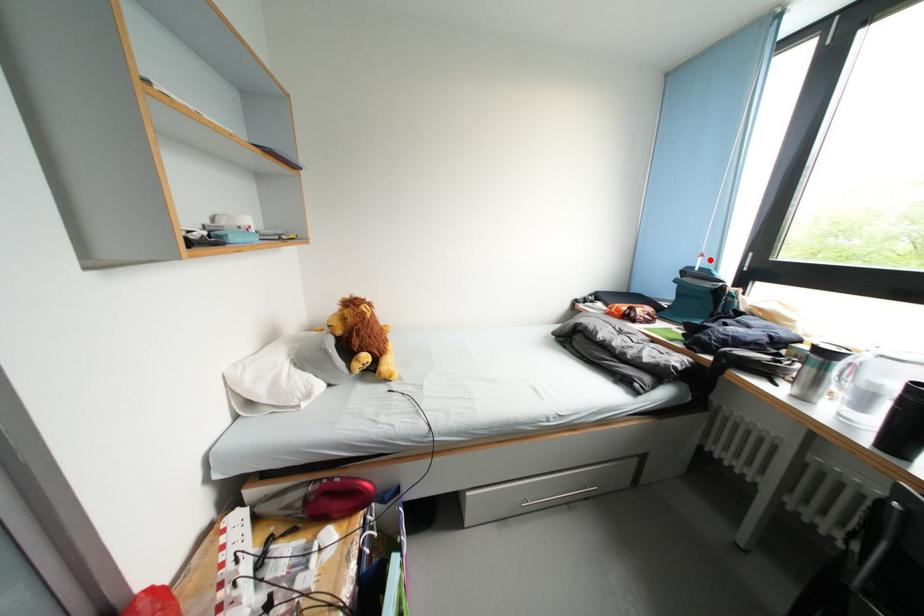
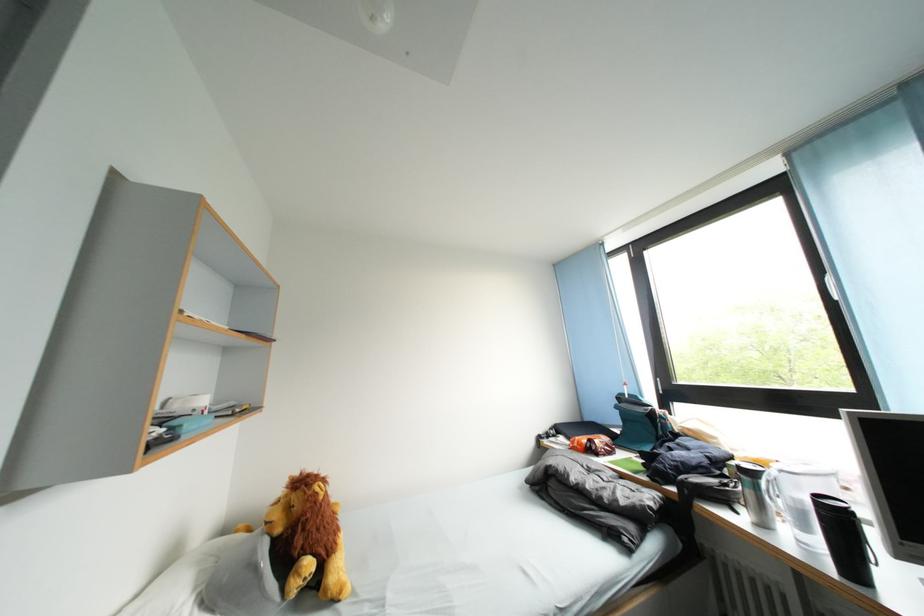
Question: I am providing you with two images of the same scene from different viewpoints. A red point is marked on the first image. At the location where the point appears in image 1, is it still visible in image 2?

Choices:
 (A) Yes
 (B) No

Answer: (A)